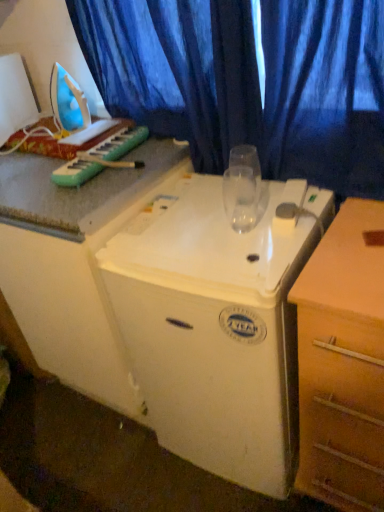
Where is `free space that is to the left of transparent glass at center`? The height and width of the screenshot is (512, 384). free space that is to the left of transparent glass at center is located at coordinates (183, 234).